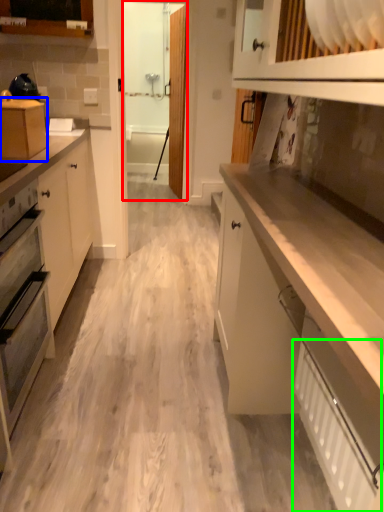
Question: Which is farther away from glass door (highlighted by a red box)? cabinetry (highlighted by a blue box) or radiator (highlighted by a green box)?

Choices:
 (A) cabinetry
 (B) radiator

Answer: (B)